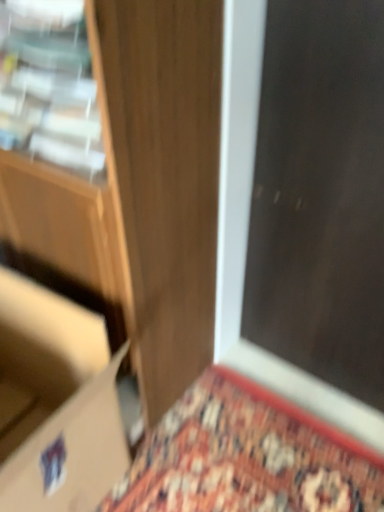
Question: Based on their sizes in the image, would you say wooden door at center is bigger or smaller than dark wood screen door at upper right?

Choices:
 (A) small
 (B) big

Answer: (B)

Question: Is point (218, 91) closer or farther from the camera than point (382, 257)?

Choices:
 (A) farther
 (B) closer

Answer: (B)

Question: Estimate the real-world distances between objects in this image. Which object is farther from the matte cardboard box at lower left?

Choices:
 (A) dark wood screen door at upper right
 (B) wooden door at center

Answer: (A)

Question: Which is nearer to the dark wood screen door at upper right?

Choices:
 (A) matte cardboard box at lower left
 (B) wooden door at center

Answer: (B)